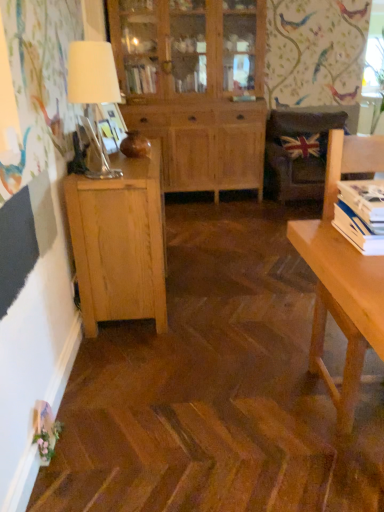
Question: Is white paper stack at right wider or thinner than natural wood cabinet at center, the 1th cabinetry from the back?

Choices:
 (A) wide
 (B) thin

Answer: (B)

Question: Which is correct: white paper stack at right is inside natural wood cabinet at center, the 1th cabinetry positioned from the top, or outside of it?

Choices:
 (A) outside
 (B) inside

Answer: (A)

Question: Which object is positioned farthest from the natural wood cabinet at center, which is counted as the second cabinetry, starting from the front?

Choices:
 (A) light brown wooden desk at right
 (B) natural wood cabinet at left, which is the second cabinetry in back-to-front order
 (C) matte white lampshade at left
 (D) brown leather chair at center
 (E) union jack fabric pillow at upper right

Answer: (A)

Question: Based on their relative distances, which object is farther from the matte white lampshade at left?

Choices:
 (A) union jack fabric pillow at upper right
 (B) brown leather chair at center
 (C) white paper stack at right
 (D) natural wood cabinet at left, which appears as the first cabinetry when ordered from the bottom
 (E) light brown wooden desk at right

Answer: (B)